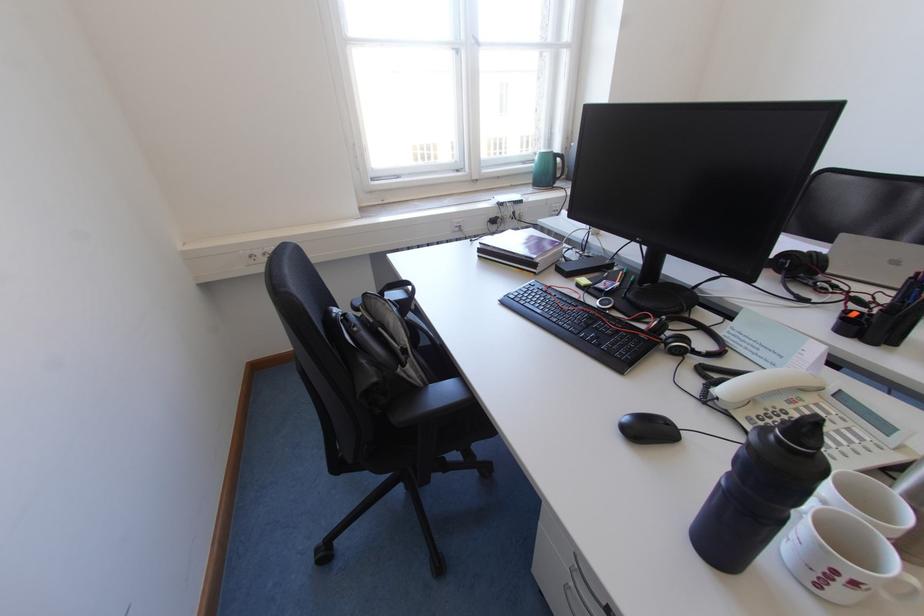
You are a GUI agent. You are given a task and a screenshot of the screen. Output one action in this format:
    pyautogui.click(x=<x>, y=<y>)
    Task: Click on the silver drawer handle
    This screenshot has width=924, height=616.
    Given the screenshot: What is the action you would take?
    pyautogui.click(x=591, y=585)